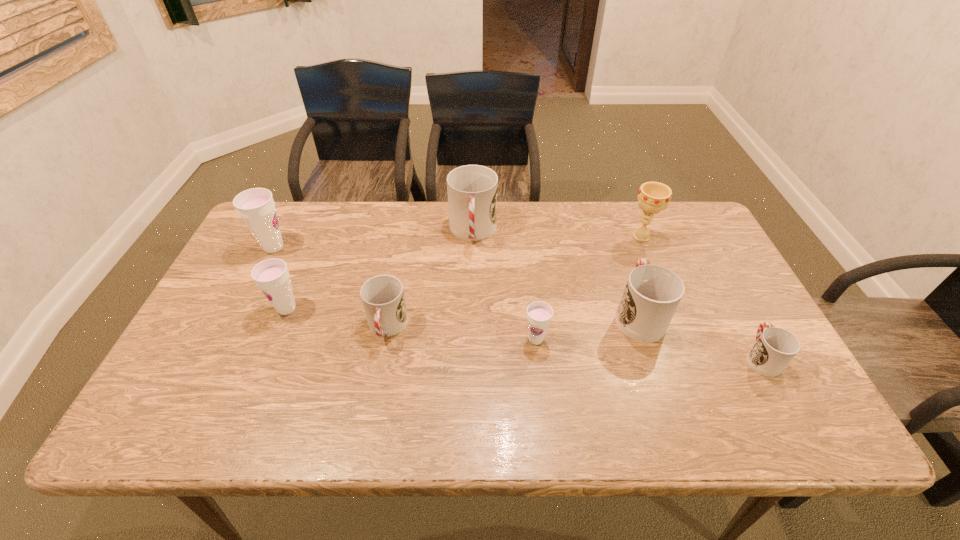
In order to click on vacant area located on the side of the second red cup from right to left where the handle is located in this screenshot , I will do `click(605, 215)`.

Where is `vacant position located on the back of the second smallest purple cup`? The width and height of the screenshot is (960, 540). vacant position located on the back of the second smallest purple cup is located at coordinates (317, 236).

I want to click on free space located on the side of the third object from left to right where the handle is located, so click(x=372, y=403).

Where is `vacant space located on the right of the rightmost purple cup`? The width and height of the screenshot is (960, 540). vacant space located on the right of the rightmost purple cup is located at coordinates (629, 339).

This screenshot has height=540, width=960. I want to click on vacant space located on the side of the smallest red cup where the handle is located, so click(726, 292).

I want to click on vacant space located on the side of the smallest red cup where the handle is located, so click(739, 318).

In order to click on vacant space located on the side of the smallest red cup where the handle is located in this screenshot , I will do `click(711, 265)`.

Where is `chalice that is at the far edge`? This screenshot has width=960, height=540. chalice that is at the far edge is located at coordinates (653, 197).

Locate an element on the screen. This screenshot has height=540, width=960. object present at the left edge is located at coordinates (256, 206).

The height and width of the screenshot is (540, 960). What are the coordinates of `object at the right edge` in the screenshot? It's located at (775, 347).